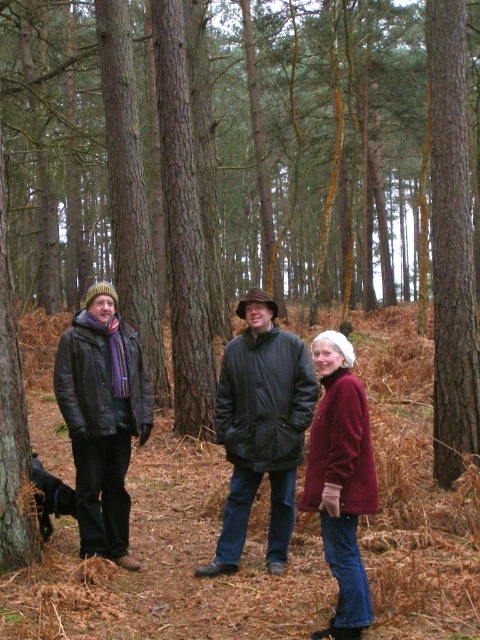
Question: From the image, what is the correct spatial relationship of leather jacket at left in relation to green rough bark tree at lower left?

Choices:
 (A) below
 (B) above

Answer: (A)

Question: Where is matte black jacket at center located in relation to green rough bark tree at lower left in the image?

Choices:
 (A) right
 (B) left

Answer: (A)

Question: Is maroon fleece jacket at center wider than green rough bark tree at lower left?

Choices:
 (A) no
 (B) yes

Answer: (B)

Question: Which object is farther from the camera taking this photo?

Choices:
 (A) maroon fleece jacket at center
 (B) matte black jacket at center
 (C) green rough bark tree at lower left
 (D) brown rough bark tree at center right

Answer: (D)

Question: Among these objects, which one is nearest to the camera?

Choices:
 (A) brown rough bark tree at center right
 (B) maroon fleece jacket at center
 (C) matte black jacket at center
 (D) leather jacket at left

Answer: (B)

Question: Which object appears closest to the camera in this image?

Choices:
 (A) matte black jacket at center
 (B) leather jacket at left
 (C) green rough bark tree at lower left

Answer: (C)